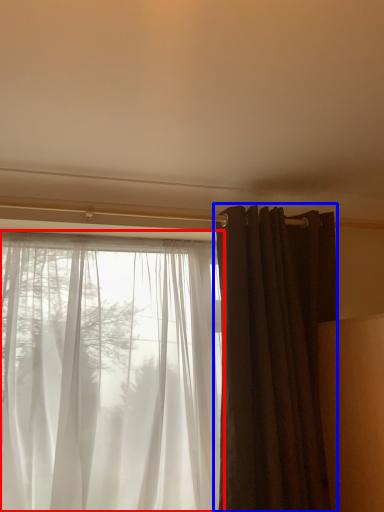
Question: Among these objects, which one is farthest to the camera, curtain (highlighted by a red box) or curtain (highlighted by a blue box)?

Choices:
 (A) curtain
 (B) curtain

Answer: (B)